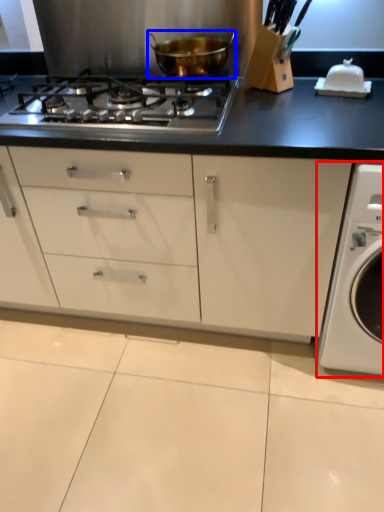
Question: Among these objects, which one is farthest to the camera, washing machine (highlighted by a red box) or kitchen appliance (highlighted by a blue box)?

Choices:
 (A) washing machine
 (B) kitchen appliance

Answer: (B)